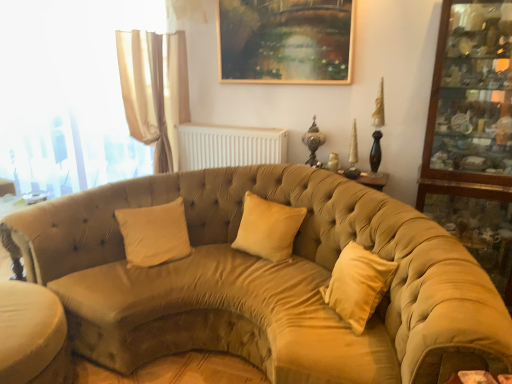
Question: Visually, is gold-framed painting at upper center positioned to the left or to the right of wooden glass cabinet at right?

Choices:
 (A) left
 (B) right

Answer: (A)

Question: Based on their sizes in the image, would you say gold-framed painting at upper center is bigger or smaller than wooden glass cabinet at right?

Choices:
 (A) big
 (B) small

Answer: (B)

Question: Which object is the closest to the beige velvet pillow at center, the first pillow in the left-to-right sequence?

Choices:
 (A) beige fabric ottoman at lower left
 (B) suede-like beige pillow at center, the 1th pillow in the right-to-left sequence
 (C) gold-framed painting at upper center
 (D) wooden glass cabinet at right
 (E) white plastic radiator at upper center

Answer: (B)

Question: Which is nearer to the wooden glass cabinet at right?

Choices:
 (A) beige fabric ottoman at lower left
 (B) suede-like beige pillow at center, acting as the 2th pillow starting from the left
 (C) gold-framed painting at upper center
 (D) translucent fabric curtain at left
 (E) white plastic radiator at upper center

Answer: (C)